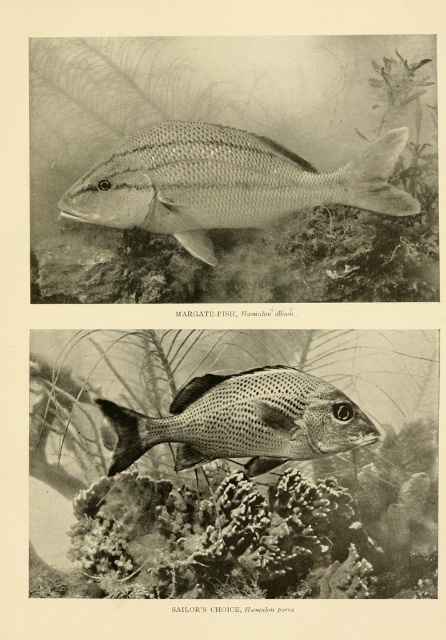
Question: Is smooth silver fish at center above speckled silver fish at center?

Choices:
 (A) no
 (B) yes

Answer: (B)

Question: Is smooth silver fish at center wider than speckled silver fish at center?

Choices:
 (A) no
 (B) yes

Answer: (B)

Question: Which of these objects is positioned closest to the smooth silver fish at center?

Choices:
 (A) speckled coral at center
 (B) speckled silver fish at center

Answer: (B)

Question: Is speckled coral at center bigger than speckled silver fish at center?

Choices:
 (A) yes
 (B) no

Answer: (A)

Question: Which of the following is the farthest from the observer?

Choices:
 (A) (108, 412)
 (B) (414, 424)
 (C) (294, 193)

Answer: (B)

Question: Which of the following is the farthest from the observer?

Choices:
 (A) smooth silver fish at center
 (B) speckled coral at center
 (C) speckled silver fish at center

Answer: (A)